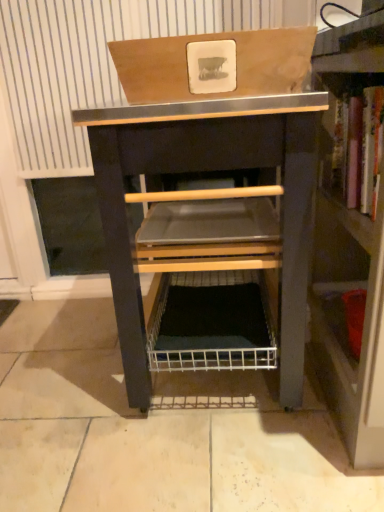
Image resolution: width=384 pixels, height=512 pixels. I want to click on vacant space to the left of black metal/wooden vanity at center, so click(61, 366).